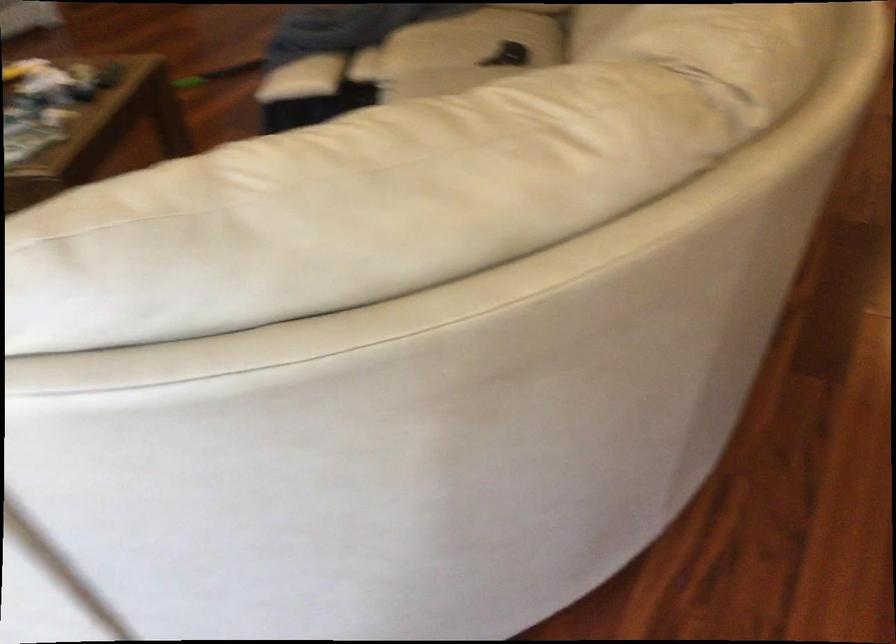
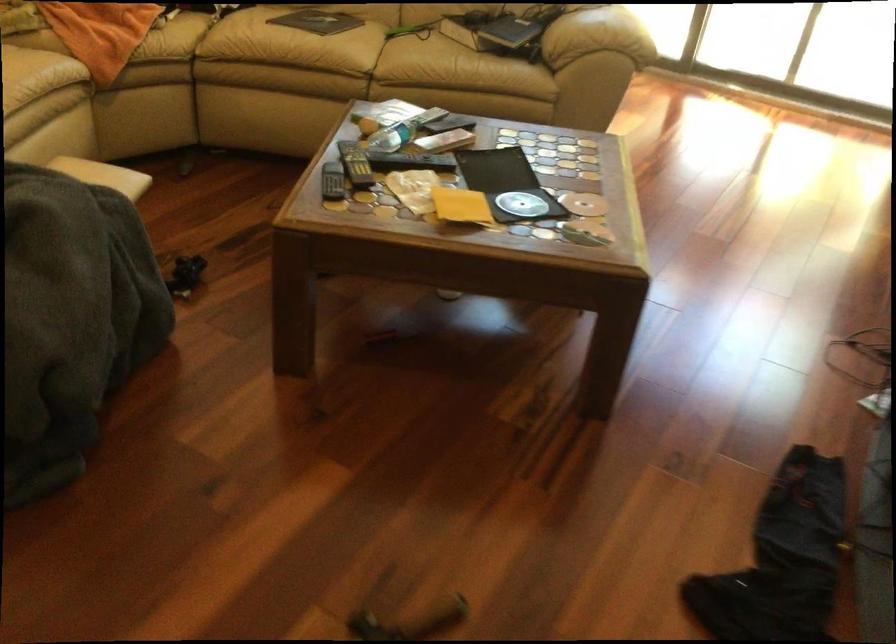
Find the pixel in the second image that matches the point at 76,78 in the first image.

(355, 164)